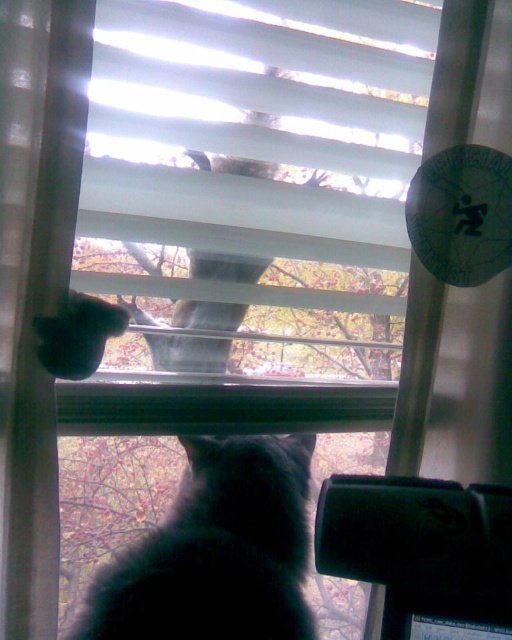
You are a photographer trying to capture both the white matte blinds at upper center and the black fluffy cat at lower center in the same frame. Based on their positions, can you tell which object is closer to the camera?

The black fluffy cat at lower center is closer to the camera because the white matte blinds at upper center is located above it, meaning the cat is in front of the blinds.

You are a cat owner trying to determine which of your cats is taller. You have a black fluffy cat at lower center and a fuzzy gray cat at upper center. Based on their positions in the image, which cat is taller?

The black fluffy cat at lower center is shorter than the fuzzy gray cat at upper center, so the fuzzy gray cat at upper center is taller.

You are a cat owner who wants to ensure your cats can comfortably interact through the window. Given the distance between the white matte blinds at upper center and the black fluffy cat at lower center, can the cats see each other clearly through the window?

The distance between the white matte blinds at upper center and the black fluffy cat at lower center is 15.73 inches, which allows enough space for the cats to see each other clearly through the window.